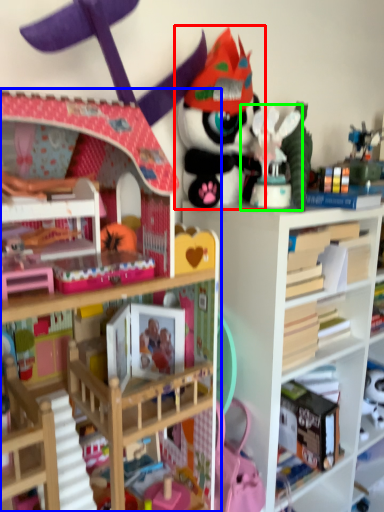
Question: Estimate the real-world distances between objects in this image. Which object is farther from toy (highlighted by a red box), bookcase (highlighted by a blue box) or toy (highlighted by a green box)?

Choices:
 (A) bookcase
 (B) toy

Answer: (A)